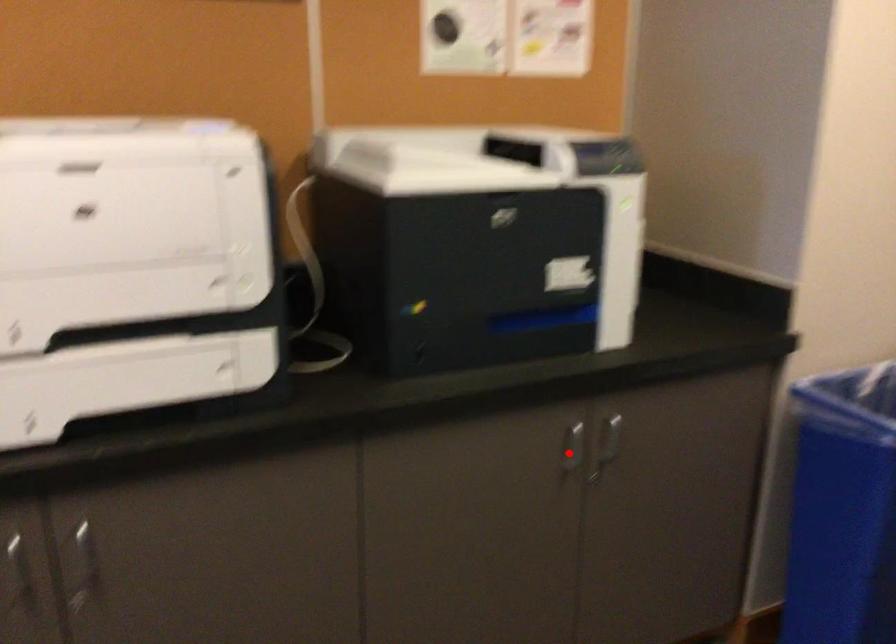
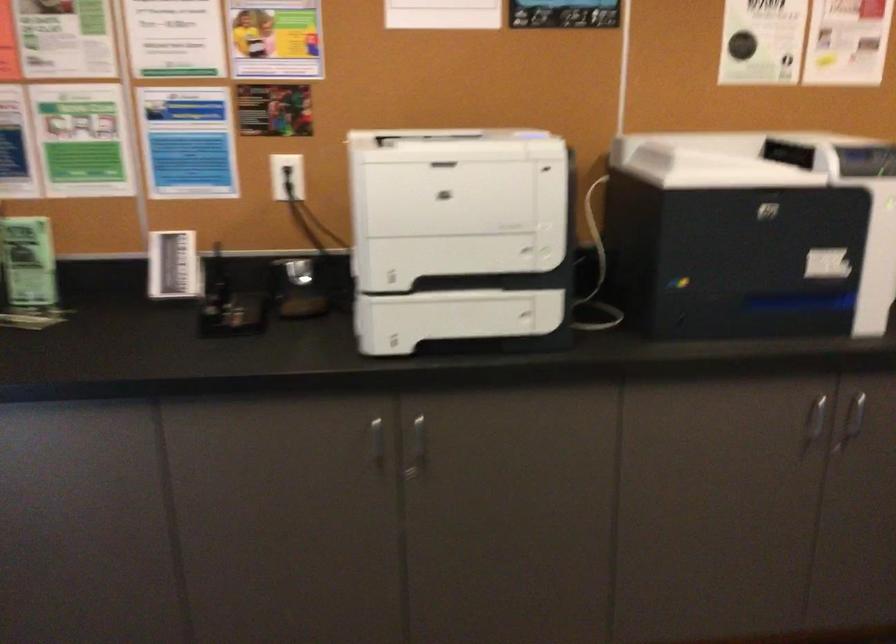
Where in the second image is the point corresponding to the highlighted location from the first image?

(815, 422)